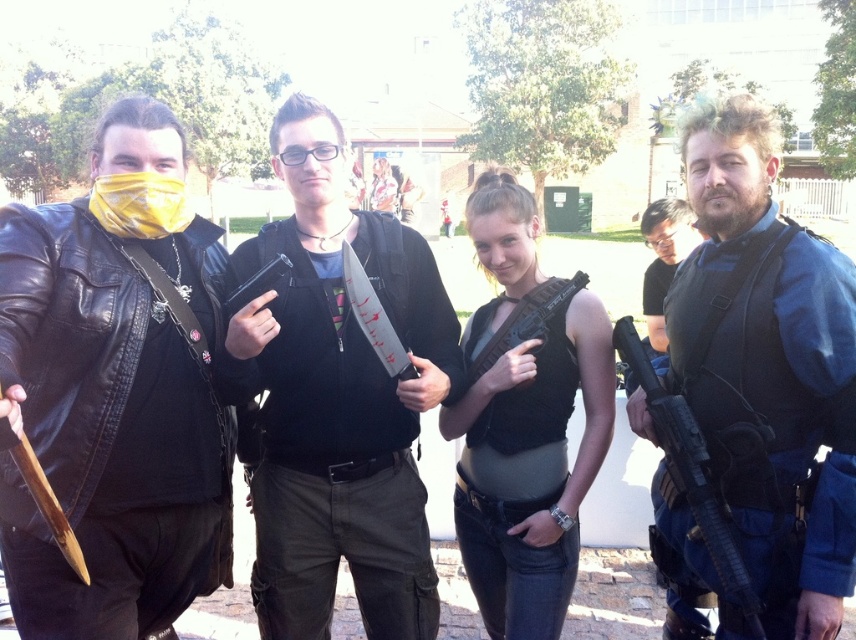
You are standing at point A which is at coordinates point(125,170). You want to walk to point B at coordinates point(627,340). Will you pass in front of or behind the person in the black leather jacket on the far left?

Since point(125,170) is in front of point(627,340), you will pass in front of the person in the black leather jacket on the far left when walking from point(125,170) to point(627,340).

In the scene, there is a blue tactical vest at right. Where is the point located at coordinates (x=767, y=369)?

The point at coordinates (x=767, y=369) corresponds to the blue tactical vest at right.

You are standing at the point with coordinates point (635, 356) and want to move towards the point with coordinates point (767, 230). Which direction should you move to reach it?

You should move forward because point (767, 230) is in front of point (635, 356).